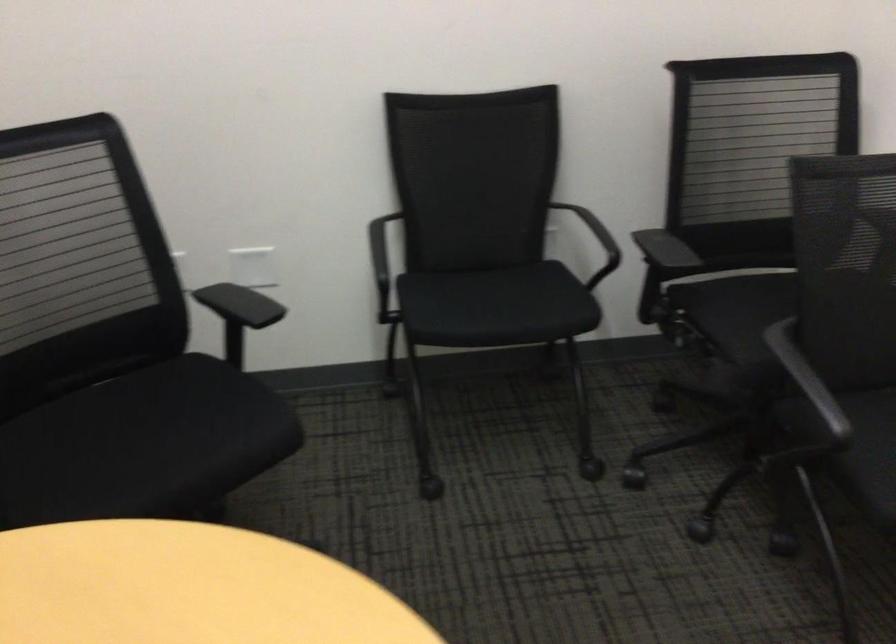
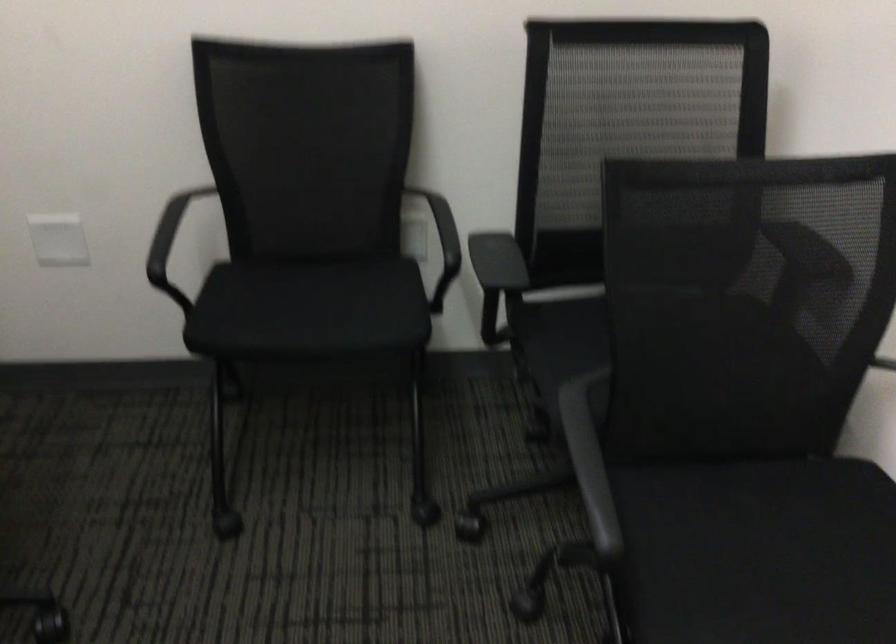
The images are taken continuously from a first-person perspective. In which direction are you moving?

The cameraman walked toward right, forward.